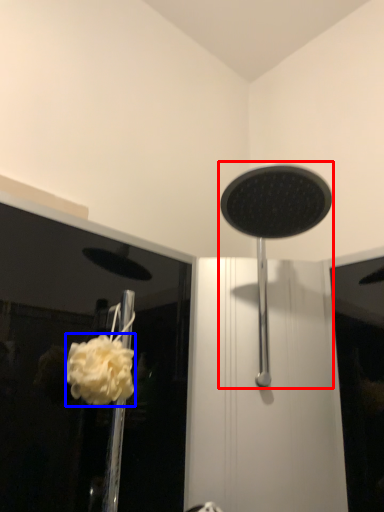
Question: Which of the following is the farthest to the observer, shower (highlighted by a red box) or flower (highlighted by a blue box)?

Choices:
 (A) shower
 (B) flower

Answer: (B)